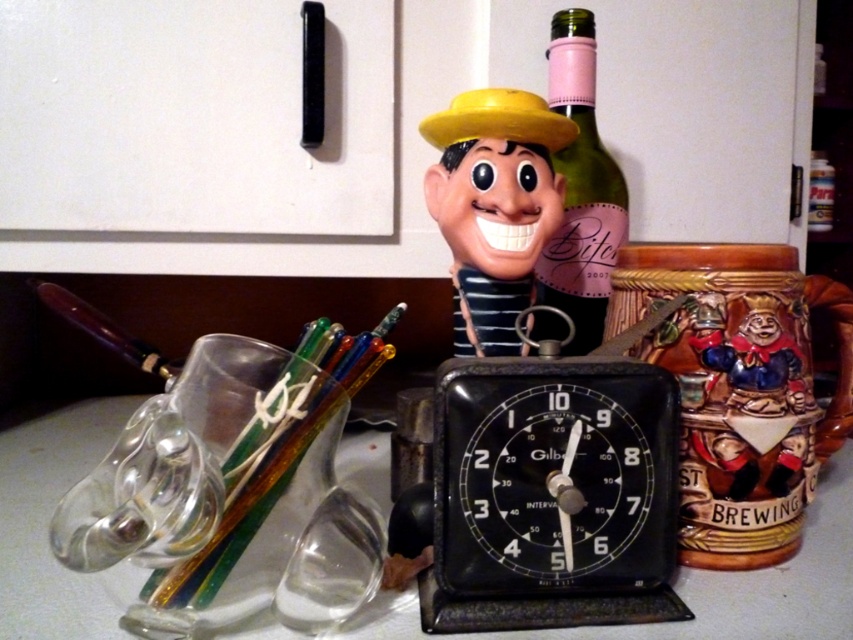
What do you see at coordinates (544, 481) in the screenshot? The image size is (853, 640). I see `black plastic clock at center` at bounding box center [544, 481].

Image resolution: width=853 pixels, height=640 pixels. In order to click on black plastic clock at center in this screenshot , I will do `click(544, 481)`.

Is clear glass cup at center positioned behind black plastic clock at center?

No, clear glass cup at center is in front of black plastic clock at center.

Who is positioned more to the left, clear glass cup at center or black plastic clock at center?

clear glass cup at center is more to the left.

Is point (1, 522) more distant than point (488, 522)?

Yes, it is.

Image resolution: width=853 pixels, height=640 pixels. Identify the location of clear glass cup at center. (706, 588).

Consider the image. Does matte plastic head at center appear on the right side of black plastic clock at center?

Incorrect, matte plastic head at center is not on the right side of black plastic clock at center.

Measure the distance between matte plastic head at center and camera.

matte plastic head at center and camera are 23.02 inches apart.

This screenshot has height=640, width=853. What do you see at coordinates (494, 205) in the screenshot?
I see `matte plastic head at center` at bounding box center [494, 205].

You are a GUI agent. You are given a task and a screenshot of the screen. Output one action in this format:
    pyautogui.click(x=<x>, y=<y>)
    Task: Click on the matte plastic head at center
    
    Given the screenshot: What is the action you would take?
    pyautogui.click(x=494, y=205)